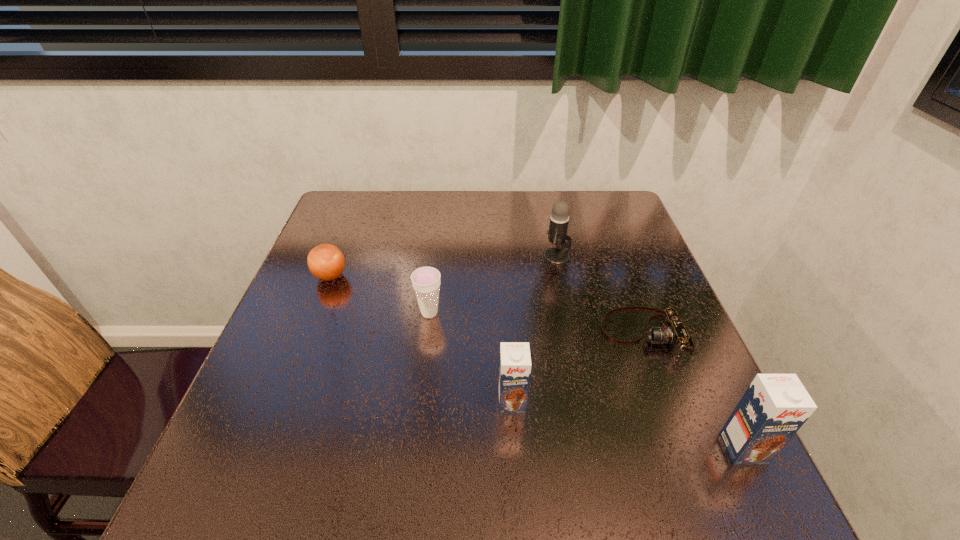
The width and height of the screenshot is (960, 540). I want to click on vacant area located 0.070m on the front label of the fifth farthest object, so tap(515, 449).

At what (x,y) coordinates should I click in order to perform the action: click on vacant area situated 0.310m on the left of the microphone. Please return your answer as a coordinate pair (x, y). The height and width of the screenshot is (540, 960). Looking at the image, I should click on (426, 257).

Find the location of a particular element. free point located 0.310m on the front-facing side of the camera is located at coordinates (460, 333).

You are a GUI agent. You are given a task and a screenshot of the screen. Output one action in this format:
    pyautogui.click(x=<x>, y=<y>)
    Task: Click on the free location located on the front-facing side of the camera
    
    Given the screenshot: What is the action you would take?
    pyautogui.click(x=427, y=333)

Where is `vacant space located on the front-facing side of the camera`? The width and height of the screenshot is (960, 540). vacant space located on the front-facing side of the camera is located at coordinates (432, 333).

The height and width of the screenshot is (540, 960). Identify the location of vacant area situated 0.180m on the left of the cup. (337, 313).

This screenshot has height=540, width=960. In order to click on free region located 0.160m on the back of the fifth tallest object in this screenshot , I will do `click(348, 230)`.

Locate an element on the screen. object that is positioned at the left edge is located at coordinates (326, 262).

Locate an element on the screen. This screenshot has width=960, height=540. chocolate milk that is at the right edge is located at coordinates (774, 407).

Find the location of `camera located in the right edge section of the desktop`. camera located in the right edge section of the desktop is located at coordinates (672, 331).